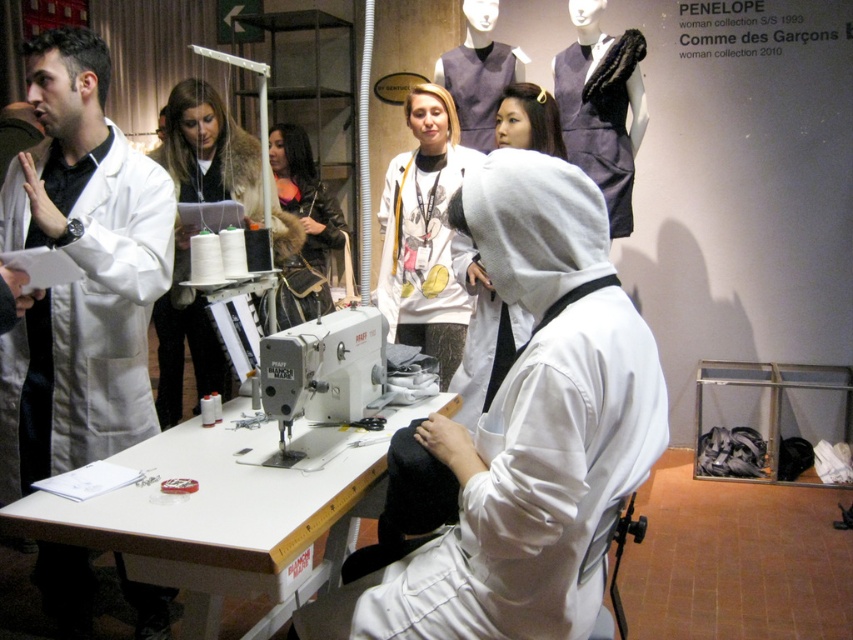
Question: Can you confirm if metallic gray sewing machine at center is bigger than leather jacket at center?

Choices:
 (A) no
 (B) yes

Answer: (A)

Question: Does white cotton robe at center have a smaller size compared to leather jacket at center?

Choices:
 (A) no
 (B) yes

Answer: (A)

Question: Considering the real-world distances, which object is closest to the white lab coat at center?

Choices:
 (A) gray matte hoodie at center
 (B) dark gray fabric dress at upper right

Answer: (A)

Question: Among these objects, which one is farthest from the camera?

Choices:
 (A) gray matte hoodie at center
 (B) white matte sweatshirt at center
 (C) matte gray dress at upper center

Answer: (C)

Question: Which object is closer to the camera taking this photo?

Choices:
 (A) matte gray dress at upper center
 (B) white matte sweatshirt at center
 (C) leather jacket at center
 (D) white cotton robe at center

Answer: (D)

Question: Can you confirm if matte black spool at center is positioned to the left of leather jacket at center?

Choices:
 (A) yes
 (B) no

Answer: (A)